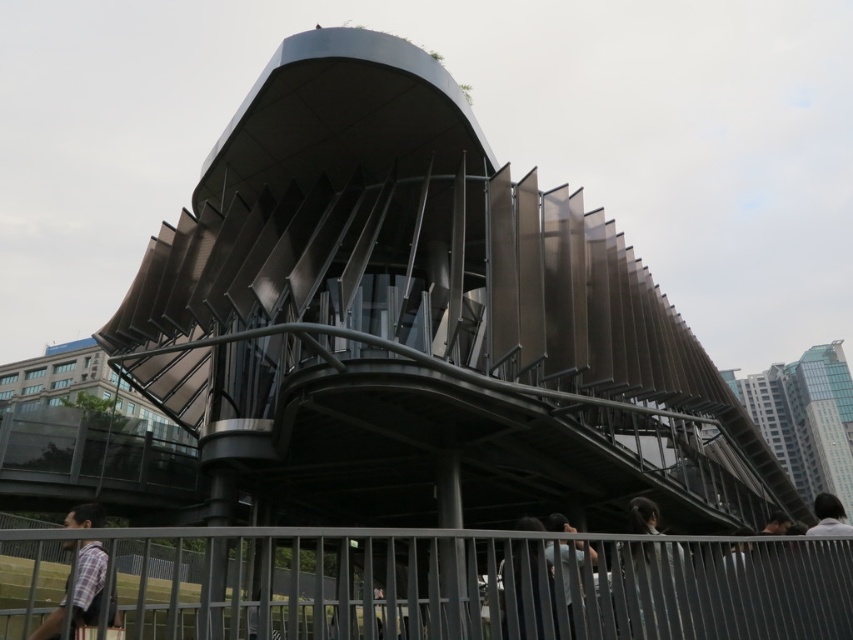
Question: Can you confirm if gray metal fence at lower center is positioned to the left of plaid shirt at lower left?

Choices:
 (A) yes
 (B) no

Answer: (A)

Question: Is glassy steel skyscraper at right to the left of light blue shirt at lower center from the viewer's perspective?

Choices:
 (A) yes
 (B) no

Answer: (B)

Question: Which of the following is the farthest from the observer?

Choices:
 (A) dark gray fabric jacket at lower center
 (B) light blue shirt at lower center
 (C) gray metal fence at lower center

Answer: (B)

Question: Which of these objects is positioned farthest from the dark brown hair at lower center?

Choices:
 (A) glassy steel skyscraper at right
 (B) white fabric at lower right
 (C) plaid shirt at lower left
 (D) gray metal fence at lower center

Answer: (A)

Question: Does dark gray fabric jacket at lower center lie in front of light blue shirt at lower center?

Choices:
 (A) yes
 (B) no

Answer: (A)

Question: Which of these objects is positioned farthest from the glassy steel skyscraper at right?

Choices:
 (A) white fabric at lower right
 (B) dark gray fabric jacket at lower center
 (C) plaid shirt at lower left
 (D) dark brown hair at lower center

Answer: (C)